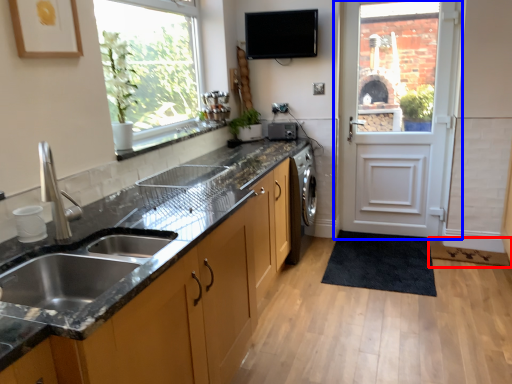
Question: Which point is closer to the camera, flat (highlighted by a red box) or door (highlighted by a blue box)?

Choices:
 (A) flat
 (B) door

Answer: (A)